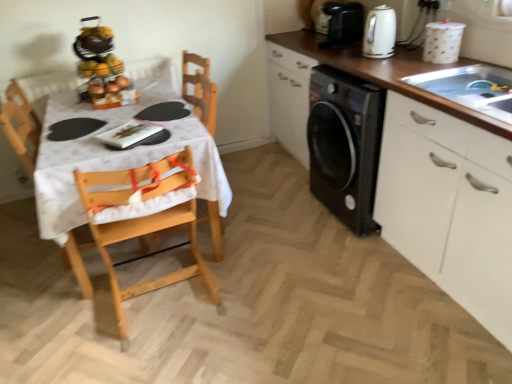
Locate an element on the screen. The height and width of the screenshot is (384, 512). vacant area to the left of wooden highchair at left is located at coordinates (71, 309).